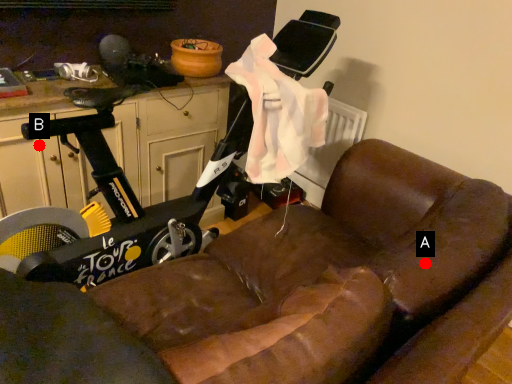
Question: Two points are circled on the image, labeled by A and B beside each circle. Which point is further to the camera?

Choices:
 (A) A is further
 (B) B is further

Answer: (B)